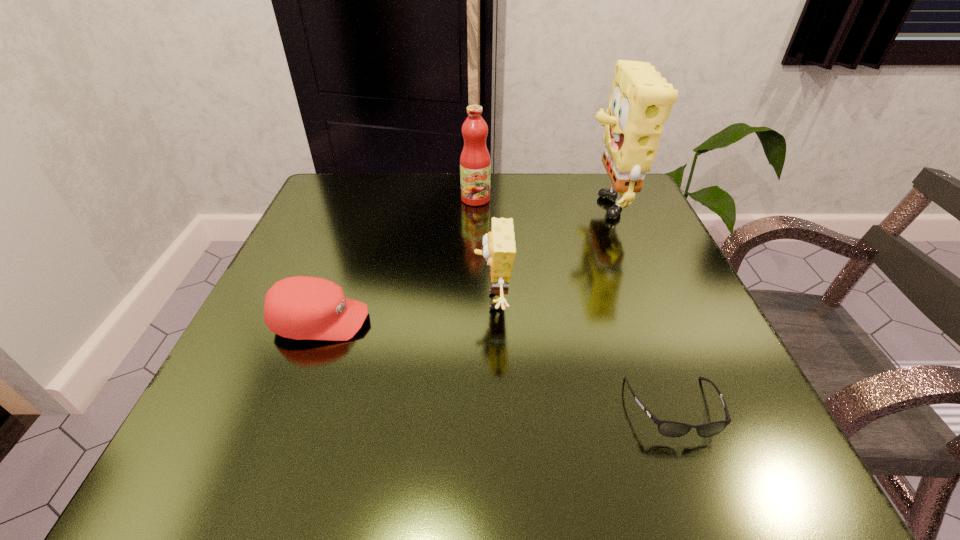
Locate an element on the screen. The image size is (960, 540). free space at the near right corner is located at coordinates (749, 444).

Image resolution: width=960 pixels, height=540 pixels. In order to click on vacant space that's between the taller sponge and the cap in this screenshot , I will do `click(462, 261)`.

Image resolution: width=960 pixels, height=540 pixels. In order to click on vacant area that lies between the shortest object and the cap in this screenshot , I will do `click(497, 365)`.

The width and height of the screenshot is (960, 540). What are the coordinates of `free space between the fruit juice and the second shortest object` in the screenshot? It's located at (398, 260).

Identify the location of free spot between the fourth shortest object and the cap. The width and height of the screenshot is (960, 540). (398, 260).

Find the location of a particular element. free space between the nearer sponge and the nearest object is located at coordinates (583, 355).

The width and height of the screenshot is (960, 540). Find the location of `free spot between the left sponge and the sunglasses`. free spot between the left sponge and the sunglasses is located at coordinates (583, 355).

Where is `free point between the right sponge and the shortest object`? This screenshot has height=540, width=960. free point between the right sponge and the shortest object is located at coordinates (638, 305).

Identify which object is located as the fourth nearest to the fruit juice. Please provide its 2D coordinates. Your answer should be formatted as a tuple, i.e. [(x, y)], where the tuple contains the x and y coordinates of a point satisfying the conditions above.

[(666, 428)]

You are a GUI agent. You are given a task and a screenshot of the screen. Output one action in this format:
    pyautogui.click(x=<x>, y=<y>)
    Task: Click on the second closest object relative to the third shortest object
    The width and height of the screenshot is (960, 540).
    Given the screenshot: What is the action you would take?
    pyautogui.click(x=301, y=307)